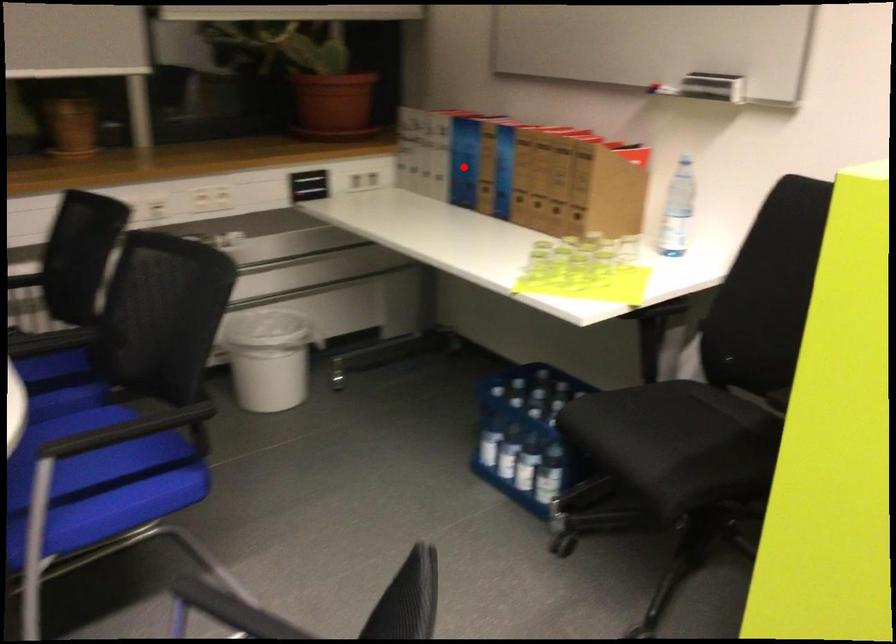
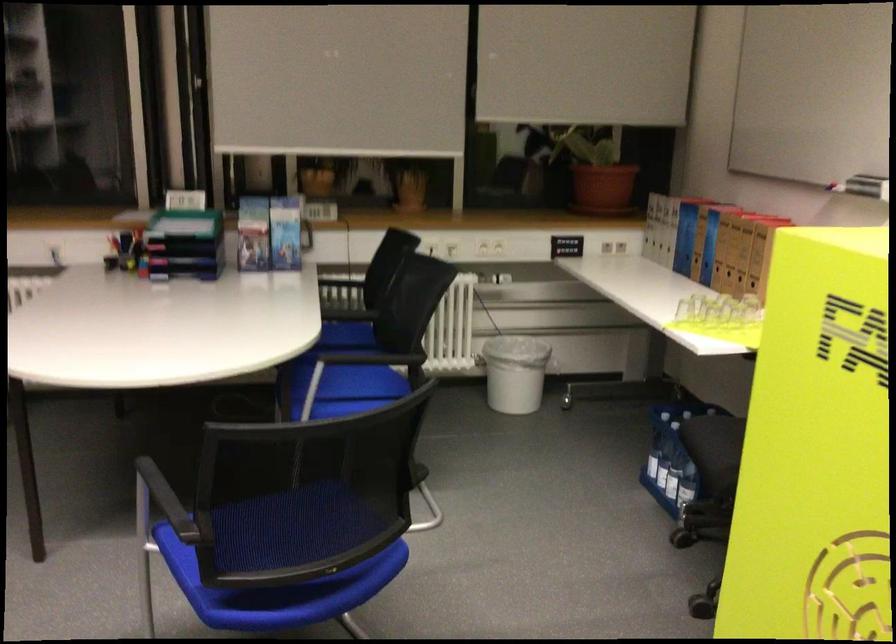
Question: A red point is marked in image1. In image2, is the corresponding 3D point closer to the camera or farther? Reply with the corresponding letter.

Choices:
 (A) The corresponding 3D point is closer.
 (B) The corresponding 3D point is farther.

Answer: (B)